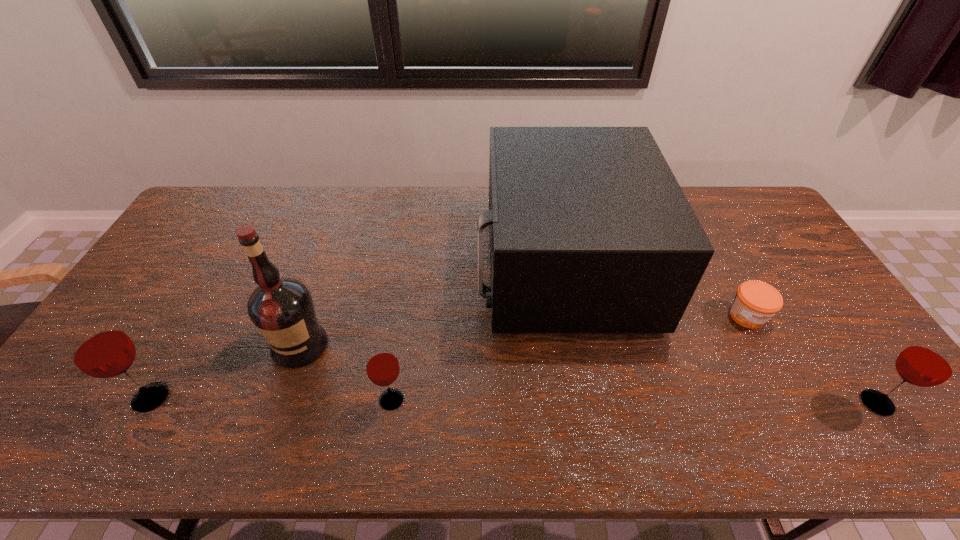
You are a GUI agent. You are given a task and a screenshot of the screen. Output one action in this format:
    pyautogui.click(x=<x>, y=<y>)
    Task: Click on the vacant space that satisfies the following two spatial constraints: 1. on the surface of the third shortest object; 2. on the left side of the tallest object
    The image size is (960, 540).
    Given the screenshot: What is the action you would take?
    pyautogui.click(x=280, y=403)

Identify the location of free region that satisfies the following two spatial constraints: 1. on the front-facing side of the fourth object from left to right; 2. on the surface of the liquor. The width and height of the screenshot is (960, 540). coord(576,346).